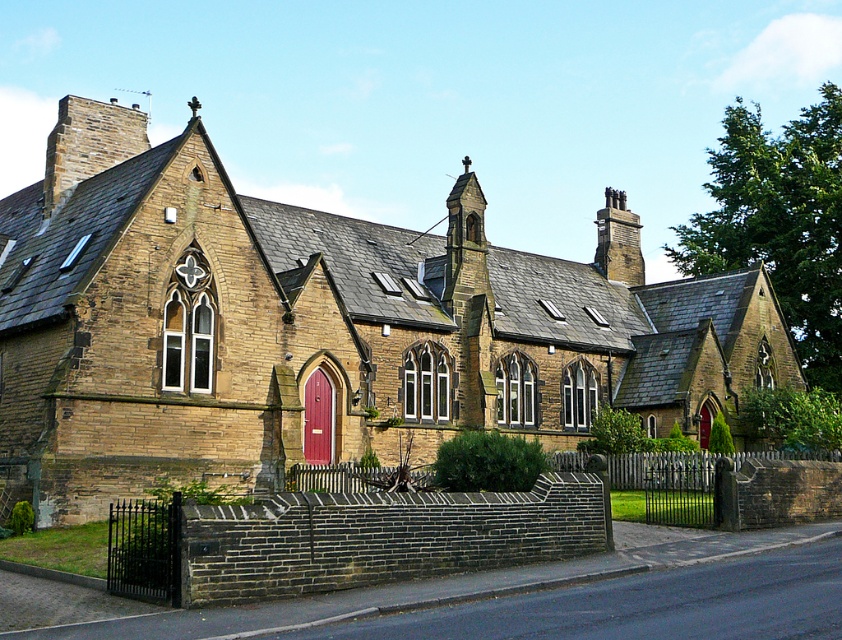
Question: Can you confirm if brown stone church at center is thinner than matte wooden door at center?

Choices:
 (A) yes
 (B) no

Answer: (B)

Question: In this image, where is brown stone church at center located relative to matte wooden door at center?

Choices:
 (A) right
 (B) left

Answer: (A)

Question: Where is brown stone church at center located in relation to matte wooden door at center in the image?

Choices:
 (A) below
 (B) above

Answer: (B)

Question: Among these points, which one is nearest to the camera?

Choices:
 (A) (308, 404)
 (B) (280, 280)

Answer: (A)

Question: Which of the following is the closest to the observer?

Choices:
 (A) matte wooden door at center
 (B) brown stone church at center

Answer: (B)